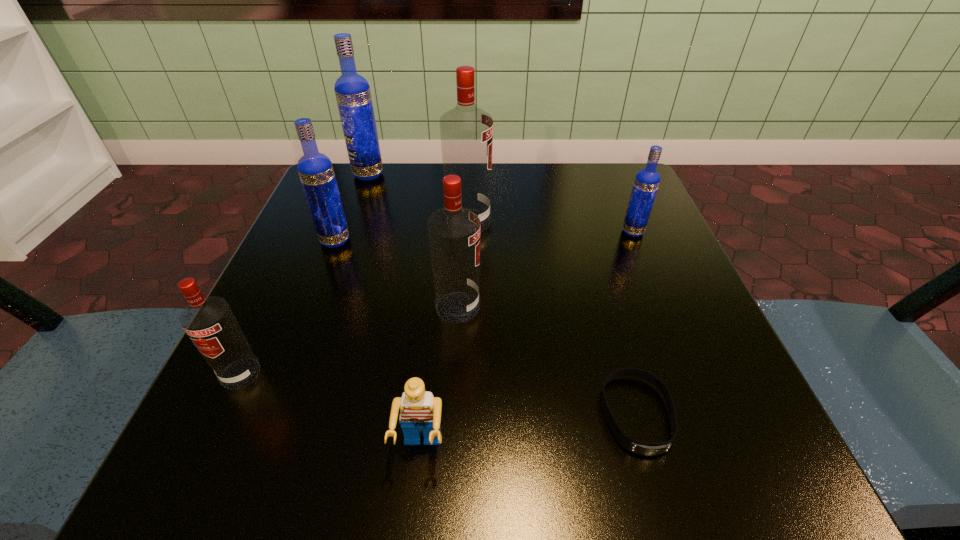
At what (x,y) coordinates should I click in order to perform the action: click on empty location between the seventh tallest object and the second biggest blue vodka. Please return your answer as a coordinate pair (x, y). Image resolution: width=960 pixels, height=540 pixels. Looking at the image, I should click on (378, 345).

I want to click on free space between the second smallest blue vodka and the rightmost vodka, so click(x=484, y=236).

Where is `free space between the second smallest blue vodka and the biggest red vodka`? free space between the second smallest blue vodka and the biggest red vodka is located at coordinates (402, 231).

This screenshot has width=960, height=540. What are the coordinates of `free spot between the farthest blue vodka and the second biggest blue vodka` in the screenshot? It's located at (351, 208).

Identify the location of vacant area between the second nearest red vodka and the Lego. (440, 378).

Image resolution: width=960 pixels, height=540 pixels. Find the location of `empty space that is in between the Lego and the shortest object`. empty space that is in between the Lego and the shortest object is located at coordinates (529, 432).

Locate an element on the screen. The height and width of the screenshot is (540, 960). free space between the second biggest blue vodka and the second object from right to left is located at coordinates (486, 327).

Identify the location of unoccupied area between the second object from right to left and the rightmost vodka. (635, 323).

Locate an element on the screen. object that is the sixth closest to the Lego is located at coordinates coord(647,180).

Locate an element on the screen. object that is the fifth nearest to the nearest red vodka is located at coordinates (643, 448).